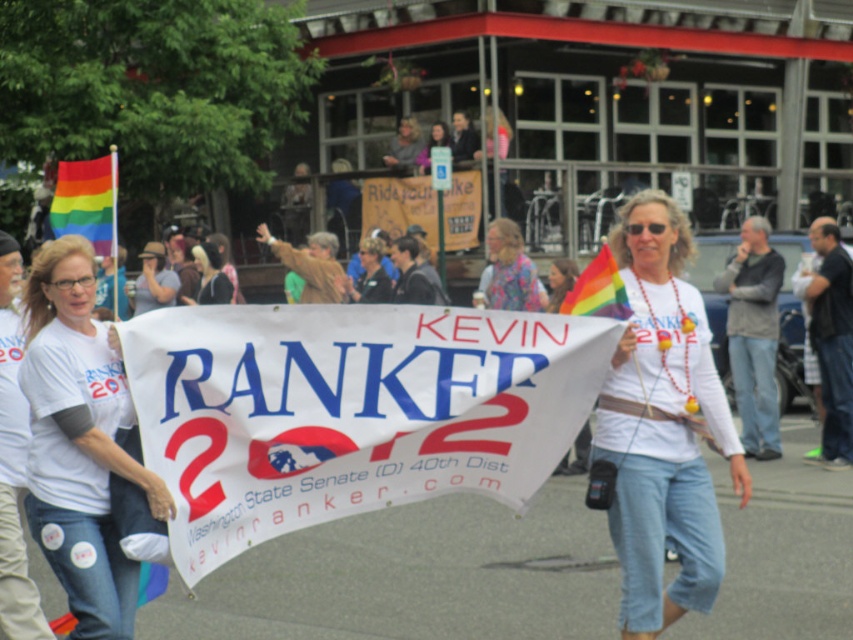
You are at a political rally and need to place two flags at two specific points. The first flag must be placed at point (682, 296) and the second at point (494, 220). Which flag will appear closer to you when viewed from your current position?

The flag placed at point (682, 296) will appear closer to you because the point is closer to the viewer than point (494, 220) according to the spatial coordinates provided.